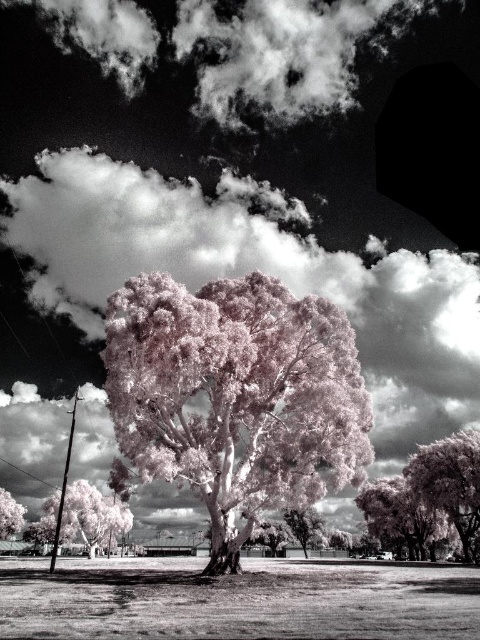
Between point (310, 486) and point (119, 529), which one is positioned behind?

The point (119, 529) is behind.

Is the position of pink/white textured tree at center more distant than that of pink textured tree at lower left?

No.

What do you see at coordinates (236, 396) in the screenshot?
I see `pink/white textured tree at center` at bounding box center [236, 396].

You are a GUI agent. You are given a task and a screenshot of the screen. Output one action in this format:
    pyautogui.click(x=<x>, y=<y>)
    Task: Click on the pink/white textured tree at center
    Image resolution: width=480 pixels, height=640 pixels.
    Given the screenshot: What is the action you would take?
    pyautogui.click(x=236, y=396)

Does smooth sand at center appear under pink textured tree at lower right?

Actually, smooth sand at center is above pink textured tree at lower right.

This screenshot has height=640, width=480. What do you see at coordinates (237, 600) in the screenshot? I see `smooth sand at center` at bounding box center [237, 600].

What are the coordinates of `smooth sand at center` in the screenshot? It's located at (237, 600).

Which is more to the left, pink/white textured tree at center or pink/white textured tree at lower left?

pink/white textured tree at lower left

Does point (135, 440) come closer to viewer compared to point (8, 500)?

Yes, point (135, 440) is in front of point (8, 500).

Find the location of a particular element. pink/white textured tree at center is located at coordinates (236, 396).